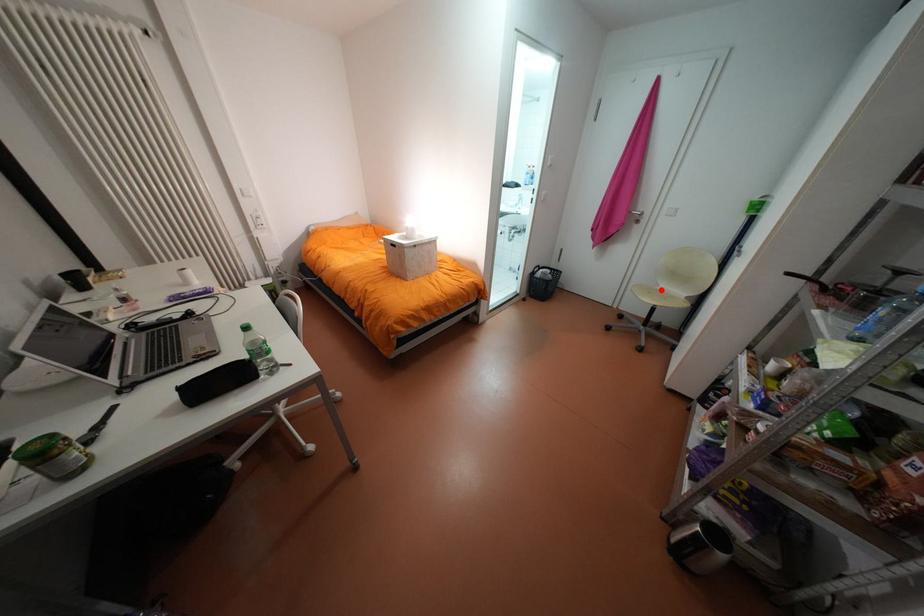
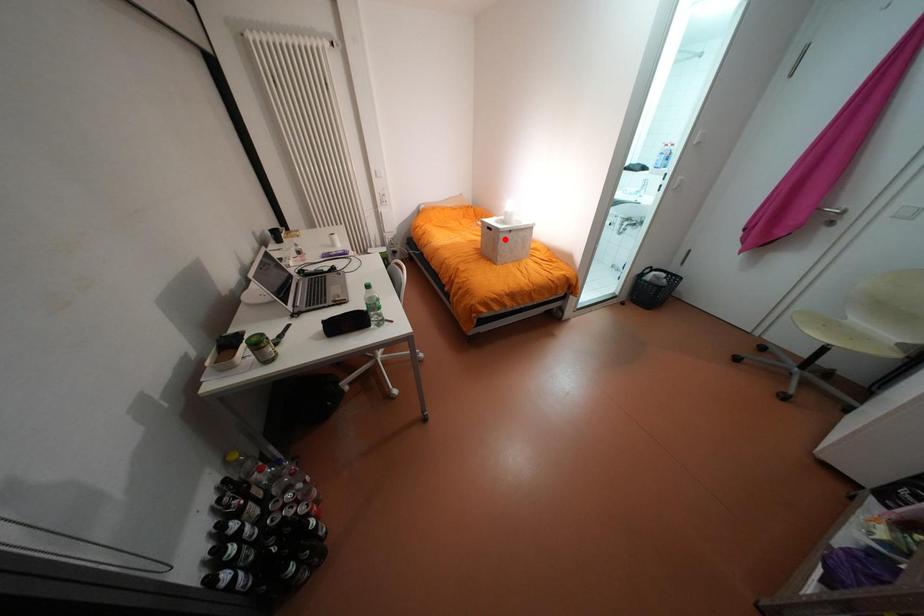
I am providing you with two images of the same scene from different viewpoints. A red point is marked on the first image and another point is marked on the second image. Do the highlighted points in image1 and image2 indicate the same real-world spot?

No